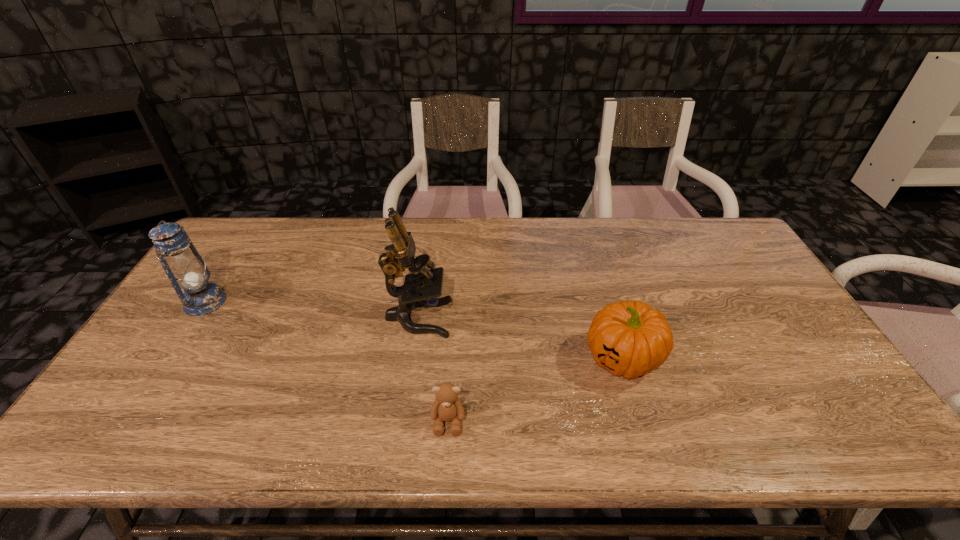
The image size is (960, 540). I want to click on vacant position in the image that satisfies the following two spatial constraints: 1. on the surface of the third tallest object; 2. on the front-facing side of the teddy bear, so click(x=640, y=421).